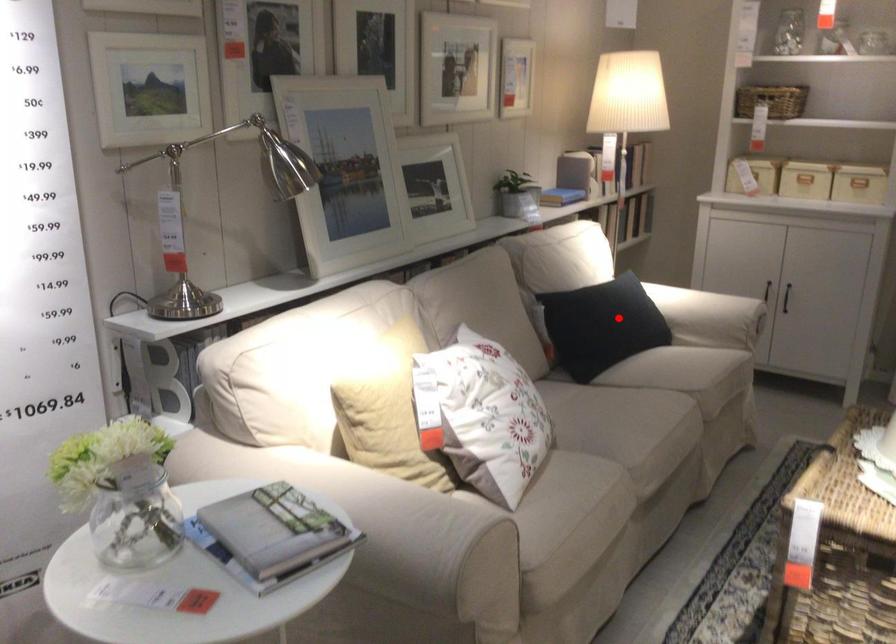
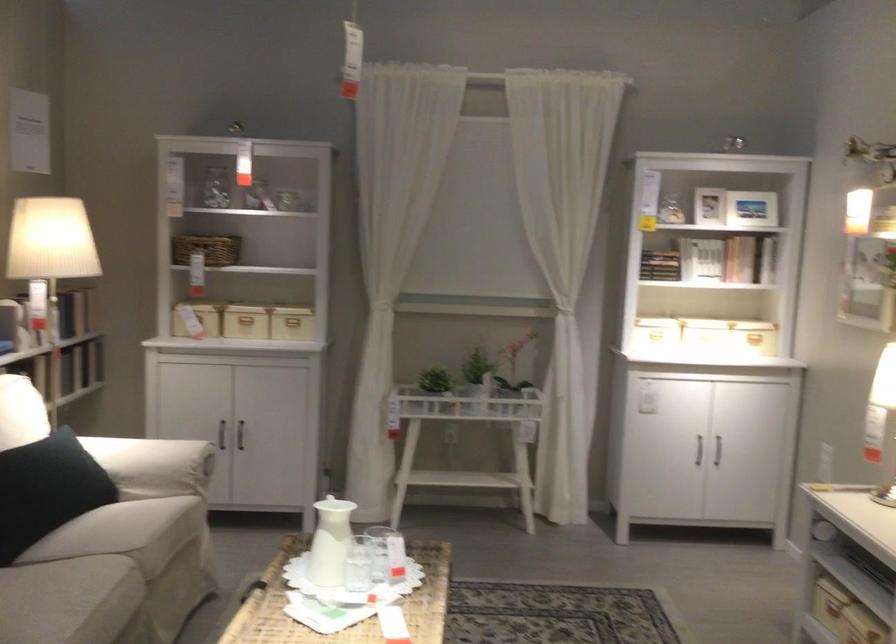
Locate, in the second image, the point that corresponds to the highlighted location in the first image.

(47, 489)